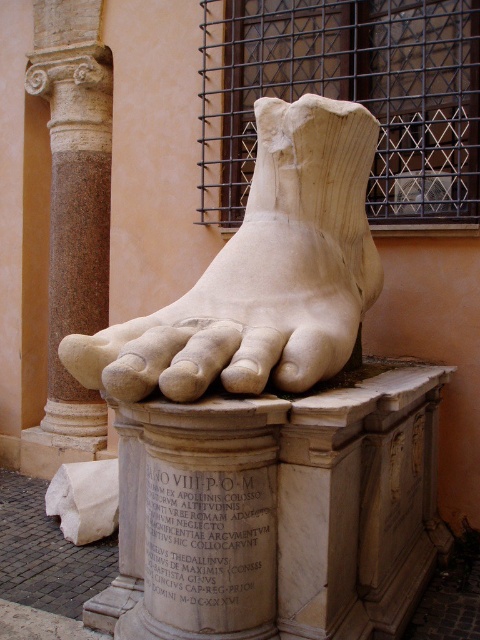
Is the position of white marble foot at center more distant than that of granite column at left?

No, white marble foot at center is in front of granite column at left.

Identify the location of white marble foot at center. (263, 273).

What are the coordinates of `white marble foot at center` in the screenshot? It's located at (263, 273).